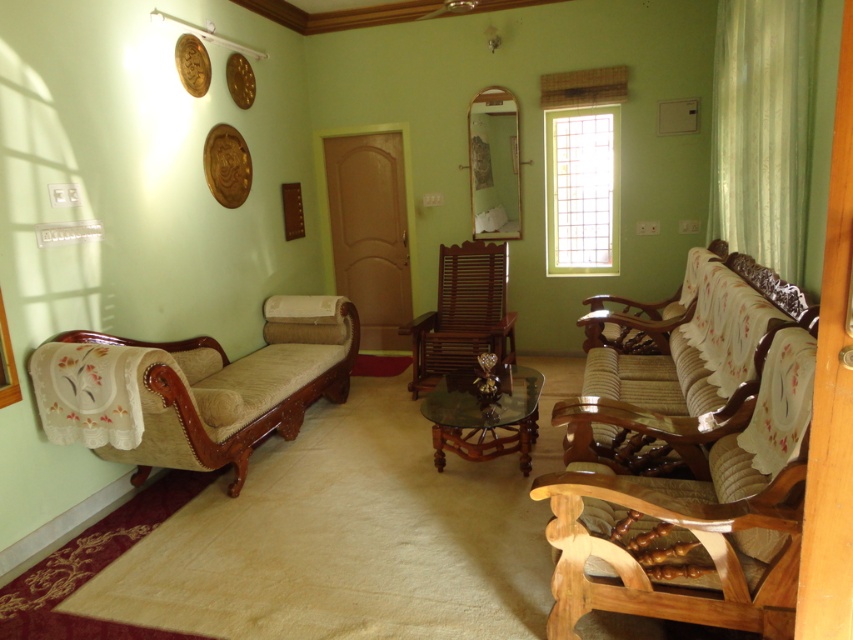
Does point (737, 0) come closer to viewer compared to point (502, 394)?

No, (737, 0) is further to viewer.

The width and height of the screenshot is (853, 640). In order to click on green sheer curtain at right in this screenshot , I will do `click(762, 129)`.

Measure the distance between point [729,93] and camera.

Point [729,93] and camera are 13.52 feet apart from each other.

Image resolution: width=853 pixels, height=640 pixels. I want to click on green sheer curtain at right, so click(x=762, y=129).

Between beige fabric daybed at left and mahogany wood rocking chair at center, which one appears on the left side from the viewer's perspective?

Positioned to the left is beige fabric daybed at left.

Is point (198, 348) in front of point (469, 285)?

Yes, point (198, 348) is closer to viewer.

Identify the location of beige fabric daybed at left. The width and height of the screenshot is (853, 640). (235, 387).

Does point (791, 116) come behind point (482, 292)?

No, it is not.

In the scene shown: Between green sheer curtain at right and mahogany wood rocking chair at center, which one is positioned lower?

mahogany wood rocking chair at center is below.

Where is `green sheer curtain at right`? green sheer curtain at right is located at coordinates pyautogui.click(x=762, y=129).